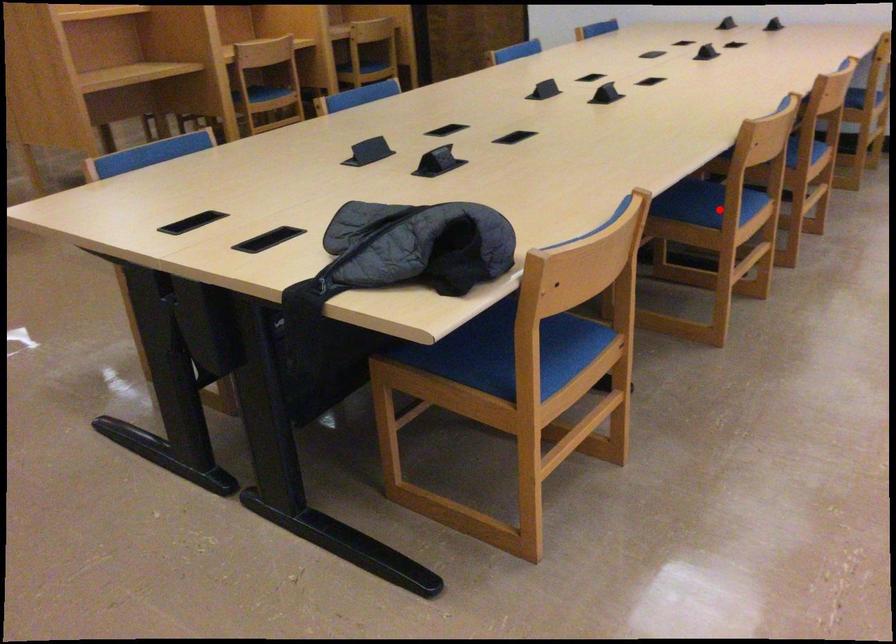
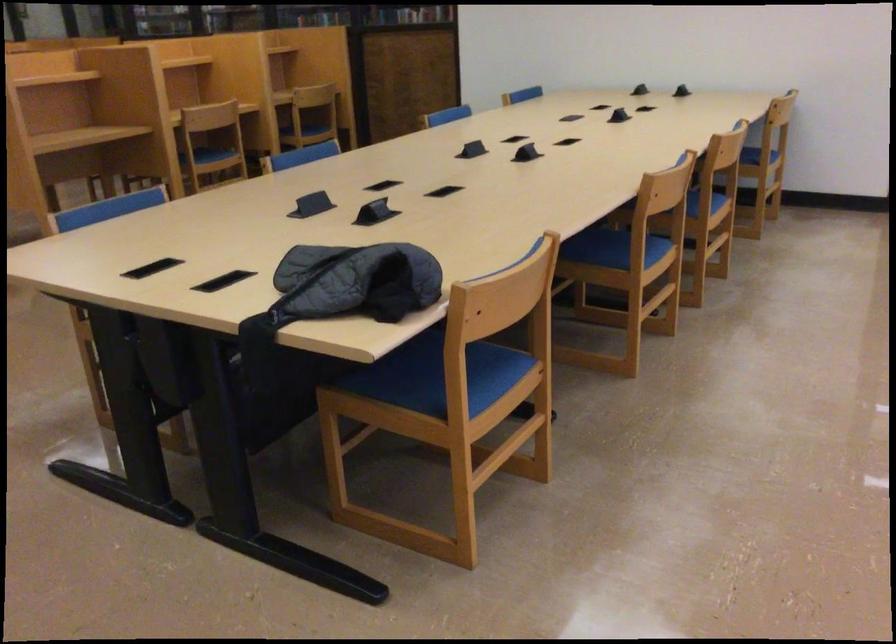
Locate, in the second image, the point that corresponds to the highlighted location in the first image.

(624, 254)